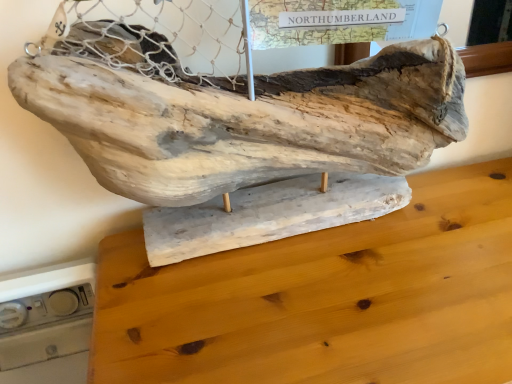
At what (x,y) coordinates should I click in order to perform the action: click on vacant space underneath natural wood sculpture at center (from a real-world perspective). Please return your answer as a coordinate pair (x, y). This screenshot has width=512, height=384. Looking at the image, I should click on (254, 241).